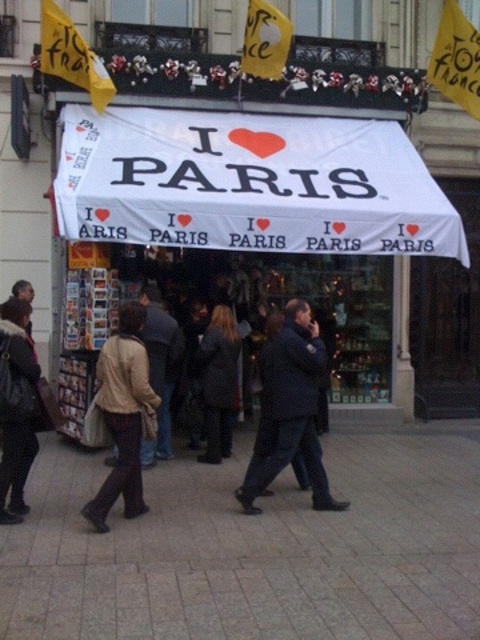
Question: Which point appears closest to the camera in this image?

Choices:
 (A) (307, 458)
 (B) (120, 468)
 (C) (155, 288)

Answer: (B)

Question: Which is farther from the dark brown leather jacket at lower left?

Choices:
 (A) white fabric canopy at center
 (B) dark brown leather coat at center

Answer: (A)

Question: Which point appears closest to the camera in this image?

Choices:
 (A) (309, 474)
 (B) (206, 196)

Answer: (A)

Question: Does dark blue jacket at center come in front of dark brown leather jacket at lower left?

Choices:
 (A) yes
 (B) no

Answer: (B)

Question: Does dark brown leather coat at center come in front of beige fabric coat at center?

Choices:
 (A) no
 (B) yes

Answer: (A)

Question: Is dark blue jacket at center above beige fabric jacket at left?

Choices:
 (A) yes
 (B) no

Answer: (A)